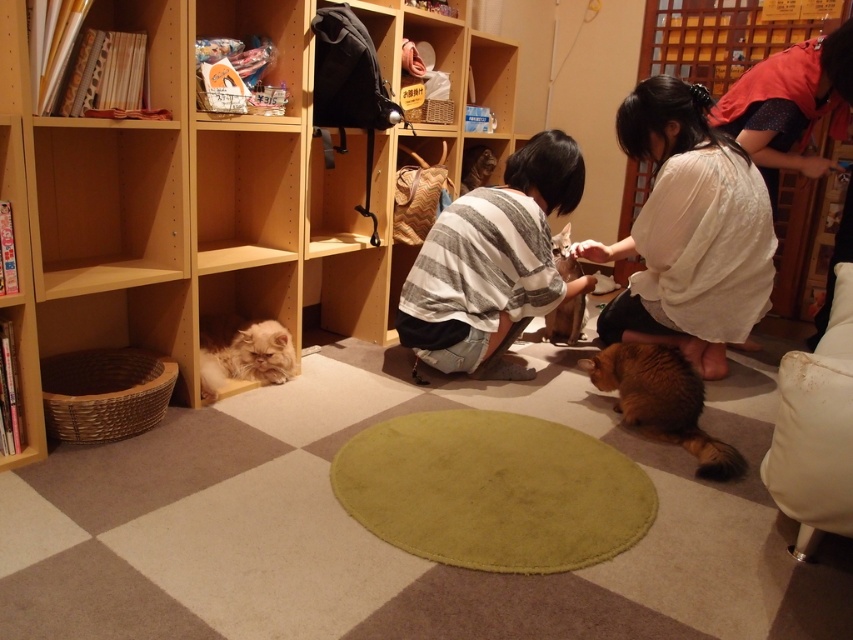
Consider the image. You are a visitor in a cat cafe and you see a striped cotton shirt at center and a fluffy white cat at lower left. Which object is closer to the entrance of the cafe?

The fluffy white cat at lower left is closer to the entrance of the cafe because the striped cotton shirt at center is to the right of the fluffy white cat at lower left, implying that the cat is positioned closer to the entrance direction.

You are a cat lover visiting this cozy indoor setting and want to pet the brown fluffy cat at center. To reach it, you need to walk around the wooden bookshelf at upper right. Since the bookshelf is in your way, can you easily walk around it to get to the cat?

The wooden bookshelf at upper right is further to the viewer than the brown fluffy cat at center, meaning the cat is closer to you. Therefore, you can easily walk around the bookshelf to reach the brown fluffy cat at center.

Based on the photo, you are standing at the point marked as point (144, 3) in the image. You want to reach the exit door located at the far end of the room. Considering the distance between you and the viewer, is it possible for you to walk straight to the door without any obstacles?

The distance between point (144, 3) and the viewer is 2.08 meters. Since the question mentions walking straight to the door located at the far end, the direct path from the point to the door may not be obstructed by the viewer, but the actual path might have other obstacles not mentioned in the scene description. However, based on the provided information, there is no indication of obstacles between the point and the door. Therefore, it is possible to walk straight to the door.